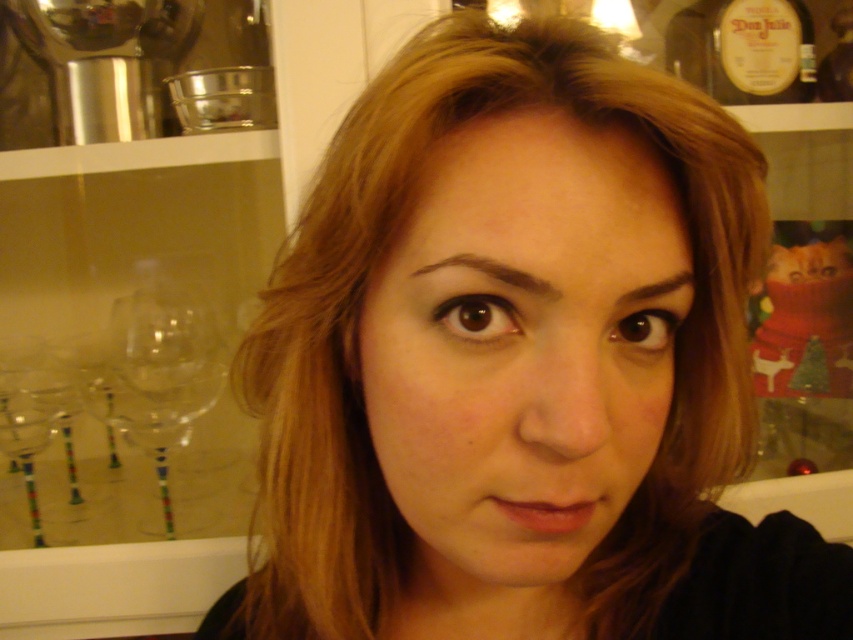
You are a bartender preparing a drink and need to reach for the transparent glass wine glass at left and the matte glass bottle at upper right. Which object will your hand encounter first as you extend your arm forward?

The transparent glass wine glass at left will be encountered first because it is positioned in front of the matte glass bottle at upper right.

You are standing in a room with two points marked on the wall. The first point is at coordinates point [175,332] and the second point is at point [793,56]. Which point is closer to you?

Point [175,332] is closer to you because it is further to the camera than point [793,56].

You are a bartender preparing a drink and need to place a wine glass at the exact center of the table. However, you accidentally placed it at point (161, 372). Based on the scene, is the transparent glass wine glass at left positioned to the left or right of the center of the table?

The transparent glass wine glass at left is positioned to the left of the center of the table.